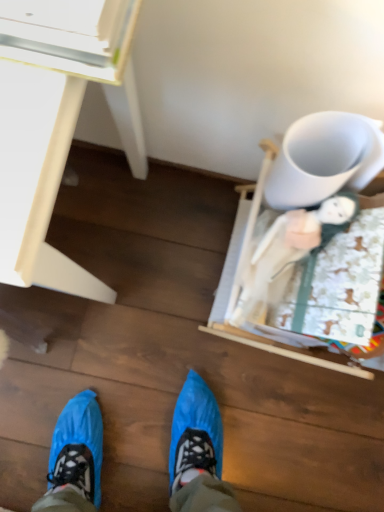
Where is `vacant area to the right of white glossy desk at upper left`? vacant area to the right of white glossy desk at upper left is located at coordinates (173, 274).